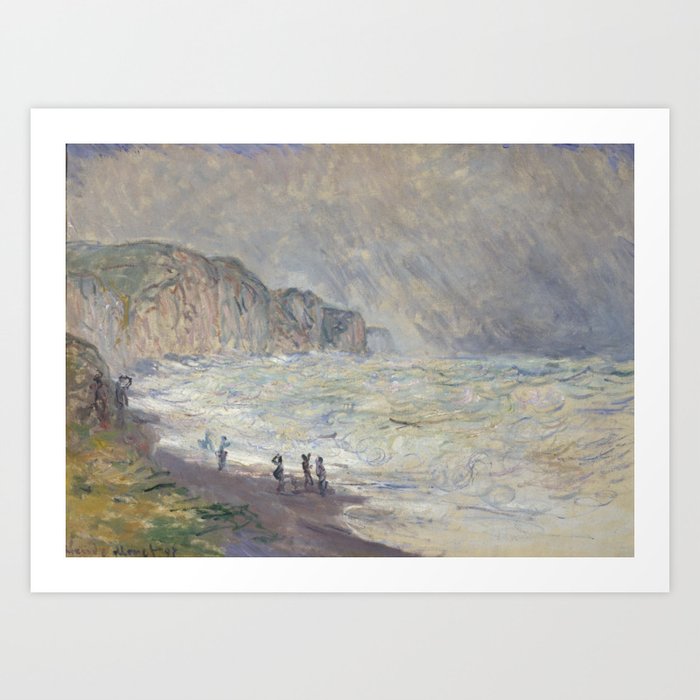
This screenshot has height=700, width=700. In order to click on wall in this screenshot , I will do `click(243, 631)`.